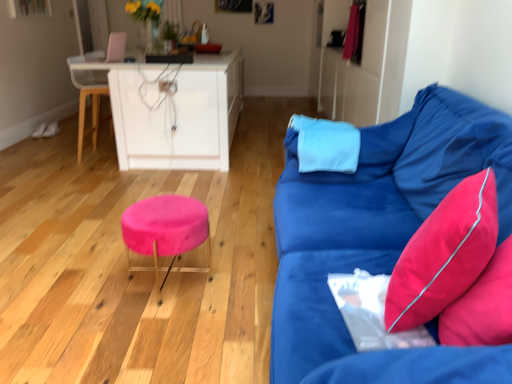
Question: Can you confirm if wooden swivel chair at left is positioned to the left of velvet blue couch at right?

Choices:
 (A) no
 (B) yes

Answer: (B)

Question: Does wooden swivel chair at left have a greater width compared to velvet blue couch at right?

Choices:
 (A) yes
 (B) no

Answer: (B)

Question: Can you confirm if wooden swivel chair at left is shorter than velvet blue couch at right?

Choices:
 (A) no
 (B) yes

Answer: (A)

Question: From a real-world perspective, is wooden swivel chair at left on velvet blue couch at right?

Choices:
 (A) no
 (B) yes

Answer: (A)

Question: Can you see wooden swivel chair at left touching velvet blue couch at right?

Choices:
 (A) no
 (B) yes

Answer: (A)

Question: Is wooden swivel chair at left thinner than velvet blue couch at right?

Choices:
 (A) yes
 (B) no

Answer: (A)

Question: Is velvet blue couch at right oriented towards velvet pink stool at center?

Choices:
 (A) no
 (B) yes

Answer: (B)

Question: Is velvet blue couch at right shorter than velvet pink stool at center?

Choices:
 (A) yes
 (B) no

Answer: (B)

Question: Is velvet blue couch at right looking in the opposite direction of velvet pink stool at center?

Choices:
 (A) yes
 (B) no

Answer: (B)

Question: Is the surface of velvet blue couch at right in direct contact with velvet pink stool at center?

Choices:
 (A) no
 (B) yes

Answer: (A)

Question: Is the position of velvet blue couch at right less distant than that of velvet pink stool at center?

Choices:
 (A) no
 (B) yes

Answer: (B)

Question: Does velvet blue couch at right appear on the left side of velvet pink stool at center?

Choices:
 (A) yes
 (B) no

Answer: (B)

Question: Can you confirm if velvet blue couch at right is positioned to the left of wooden swivel chair at left?

Choices:
 (A) yes
 (B) no

Answer: (B)